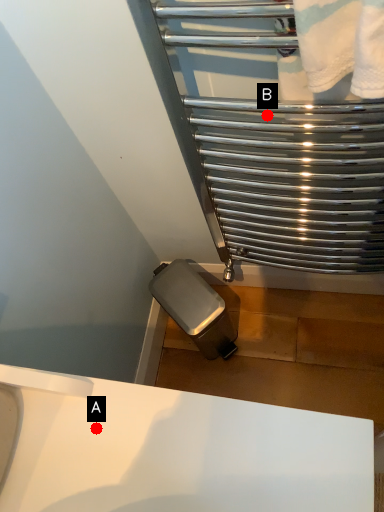
Question: Two points are circled on the image, labeled by A and B beside each circle. Which of the following is the farthest from the observer?

Choices:
 (A) A is further
 (B) B is further

Answer: (B)